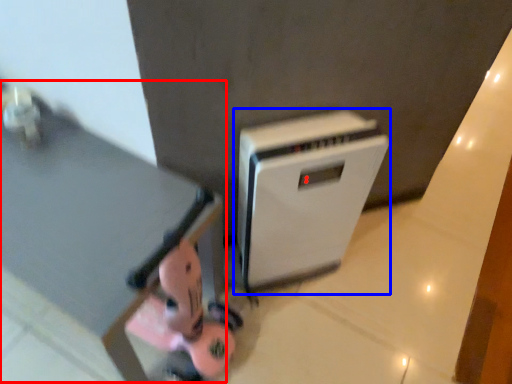
Question: Which object appears farthest to the camera in this image, table (highlighted by a red box) or home appliance (highlighted by a blue box)?

Choices:
 (A) table
 (B) home appliance

Answer: (B)